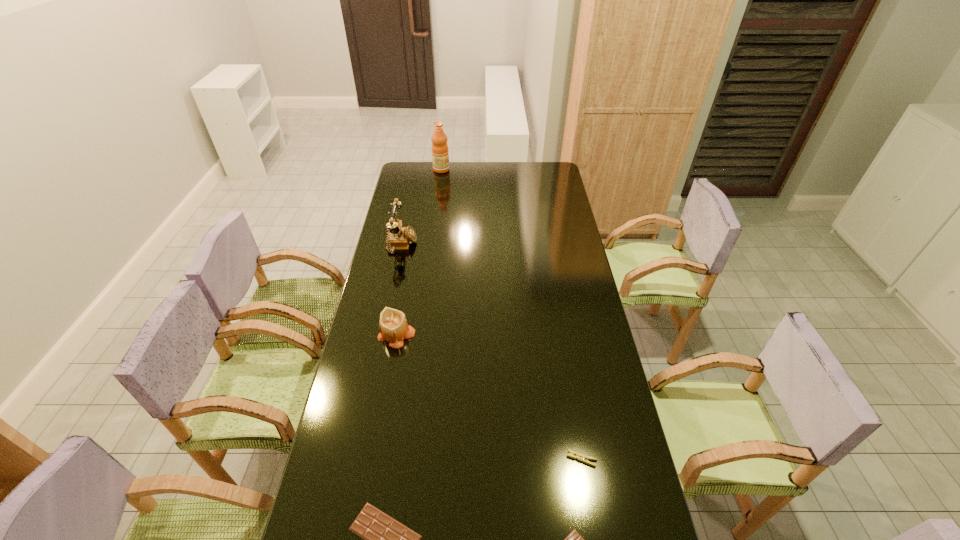
Find the location of a particular element. The width and height of the screenshot is (960, 540). fruit juice is located at coordinates 440,156.

This screenshot has width=960, height=540. I want to click on the farthest object, so click(440, 156).

The height and width of the screenshot is (540, 960). I want to click on the fifth nearest object, so click(398, 238).

This screenshot has height=540, width=960. I want to click on telephone, so click(398, 238).

Identify the location of the fourth nearest object. (393, 327).

You are a GUI agent. You are given a task and a screenshot of the screen. Output one action in this format:
    pyautogui.click(x=<x>, y=<y>)
    Task: Click on the candle
    
    Given the screenshot: What is the action you would take?
    pyautogui.click(x=393, y=327)

At what (x,y) coordinates should I click in order to perform the action: click on the fourth tallest object. Please return your answer as a coordinate pair (x, y). Looking at the image, I should click on (580, 457).

Locate an element on the screen. The height and width of the screenshot is (540, 960). the fourth farthest object is located at coordinates (580, 457).

This screenshot has height=540, width=960. What are the coordinates of `vacant space situated on the label side of the tallest object` in the screenshot? It's located at (468, 170).

Image resolution: width=960 pixels, height=540 pixels. I want to click on vacant space located on the dial number of the telephone, so click(491, 246).